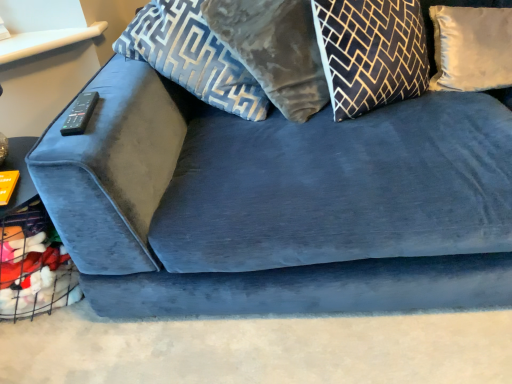
Question: Would you say white satin pillow at upper right, placed as the fourth pillow when sorted from left to right, contains black plastic remote at upper left?

Choices:
 (A) no
 (B) yes

Answer: (A)

Question: Does white satin pillow at upper right, which is the first pillow in right-to-left order, come behind black plastic remote at upper left?

Choices:
 (A) no
 (B) yes

Answer: (B)

Question: Considering the relative sizes of white satin pillow at upper right, which is the first pillow in right-to-left order, and black plastic remote at upper left in the image provided, is white satin pillow at upper right, which is the first pillow in right-to-left order, wider than black plastic remote at upper left?

Choices:
 (A) yes
 (B) no

Answer: (B)

Question: Is white satin pillow at upper right, placed as the fourth pillow when sorted from left to right, smaller than black plastic remote at upper left?

Choices:
 (A) yes
 (B) no

Answer: (B)

Question: Considering the relative positions of white satin pillow at upper right, placed as the fourth pillow when sorted from left to right, and black plastic remote at upper left in the image provided, is white satin pillow at upper right, placed as the fourth pillow when sorted from left to right, to the right of black plastic remote at upper left from the viewer's perspective?

Choices:
 (A) yes
 (B) no

Answer: (A)

Question: Can you confirm if white satin pillow at upper right, which is the first pillow in right-to-left order, is shorter than black plastic remote at upper left?

Choices:
 (A) no
 (B) yes

Answer: (A)

Question: Is white satin pillow at upper right, placed as the fourth pillow when sorted from left to right, facing away from velvet gray pillow at upper center, which appears as the 3th pillow when viewed from the right?

Choices:
 (A) yes
 (B) no

Answer: (B)

Question: Is white satin pillow at upper right, which is the first pillow in right-to-left order, wider than velvet gray pillow at upper center, placed as the second pillow when sorted from left to right?

Choices:
 (A) no
 (B) yes

Answer: (A)

Question: Does white satin pillow at upper right, which is the first pillow in right-to-left order, have a larger size compared to velvet gray pillow at upper center, which appears as the 3th pillow when viewed from the right?

Choices:
 (A) no
 (B) yes

Answer: (A)

Question: Can you confirm if white satin pillow at upper right, placed as the fourth pillow when sorted from left to right, is smaller than velvet gray pillow at upper center, which appears as the 3th pillow when viewed from the right?

Choices:
 (A) no
 (B) yes

Answer: (B)

Question: Is white satin pillow at upper right, which is the first pillow in right-to-left order, to the right of velvet gray pillow at upper center, which appears as the 3th pillow when viewed from the right, from the viewer's perspective?

Choices:
 (A) yes
 (B) no

Answer: (A)

Question: Would you say velvet gray pillow at upper center, which appears as the 3th pillow when viewed from the right, is part of white satin pillow at upper right, placed as the fourth pillow when sorted from left to right,'s contents?

Choices:
 (A) yes
 (B) no

Answer: (B)